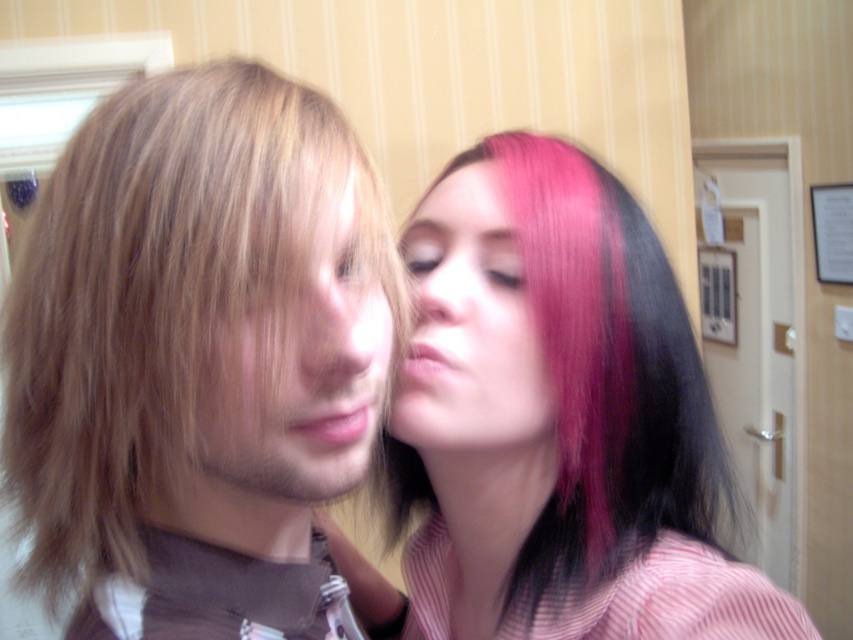
Can you confirm if blonde hair at left is shorter than pink matte hair at upper center?

In fact, blonde hair at left may be taller than pink matte hair at upper center.

Does blonde hair at left lie in front of pink matte hair at upper center?

Yes, it is.

Measure the distance between blonde hair at left and camera.

The distance of blonde hair at left from camera is 12.47 inches.

Find the location of `blonde hair at left`. blonde hair at left is located at coordinates (190, 360).

Which is in front, point (337, 438) or point (451, 291)?

Point (337, 438)

Which is more to the left, blonde hair at center or matte pink nose at center?

Positioned to the left is blonde hair at center.

Who is more forward, (323, 410) or (459, 256)?

Point (323, 410) is in front.

What are the coordinates of `blonde hair at center` in the screenshot? It's located at (306, 355).

Is shiny pink hair at center shorter than matte skin nose at center?

In fact, shiny pink hair at center may be taller than matte skin nose at center.

From the picture: Is shiny pink hair at center positioned in front of matte skin nose at center?

No.

Image resolution: width=853 pixels, height=640 pixels. Identify the location of shiny pink hair at center. (566, 420).